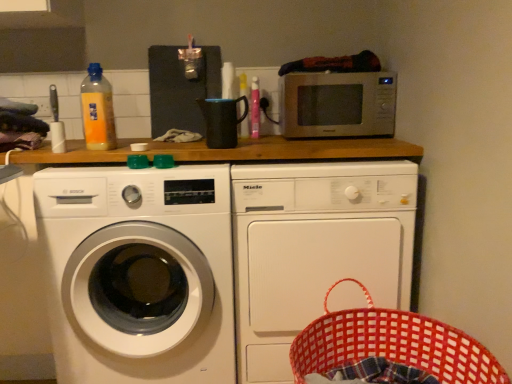
Question: Is satin silver microwave at upper center with white glossy washing machine at left, arranged as the first washing machine when viewed from the left?

Choices:
 (A) no
 (B) yes

Answer: (A)

Question: From the image's perspective, is satin silver microwave at upper center on white glossy washing machine at left, the 2th washing machine from the right?

Choices:
 (A) yes
 (B) no

Answer: (A)

Question: Does satin silver microwave at upper center appear on the right side of white glossy washing machine at left, arranged as the first washing machine when viewed from the left?

Choices:
 (A) yes
 (B) no

Answer: (A)

Question: Could you tell me if satin silver microwave at upper center is facing white glossy washing machine at left, the 2th washing machine from the right?

Choices:
 (A) no
 (B) yes

Answer: (A)

Question: From the image's perspective, is satin silver microwave at upper center beneath white glossy washing machine at left, arranged as the first washing machine when viewed from the left?

Choices:
 (A) no
 (B) yes

Answer: (A)

Question: Does satin silver microwave at upper center have a smaller size compared to white glossy washing machine at left, arranged as the first washing machine when viewed from the left?

Choices:
 (A) yes
 (B) no

Answer: (A)

Question: Is red woven basket at lower right in front of yellow translucent bottle at upper left, which ranks as the 2th bottle in back-to-front order?

Choices:
 (A) no
 (B) yes

Answer: (B)

Question: Is red woven basket at lower right oriented away from yellow translucent bottle at upper left, which is the 1th bottle in front-to-back order?

Choices:
 (A) no
 (B) yes

Answer: (A)

Question: Can you confirm if red woven basket at lower right is taller than yellow translucent bottle at upper left, which is the 1th bottle in front-to-back order?

Choices:
 (A) yes
 (B) no

Answer: (A)

Question: From a real-world perspective, does red woven basket at lower right sit lower than yellow translucent bottle at upper left, which is the 1th bottle in front-to-back order?

Choices:
 (A) yes
 (B) no

Answer: (A)

Question: Is red woven basket at lower right far from yellow translucent bottle at upper left, which ranks as the 2th bottle in back-to-front order?

Choices:
 (A) no
 (B) yes

Answer: (B)

Question: Is red woven basket at lower right further to camera compared to yellow translucent bottle at upper left, which ranks as the 2th bottle in back-to-front order?

Choices:
 (A) no
 (B) yes

Answer: (A)

Question: Does translucent plastic bottle at upper center, which ranks as the second bottle in left-to-right order, have a lesser height compared to satin silver microwave at upper center?

Choices:
 (A) yes
 (B) no

Answer: (B)